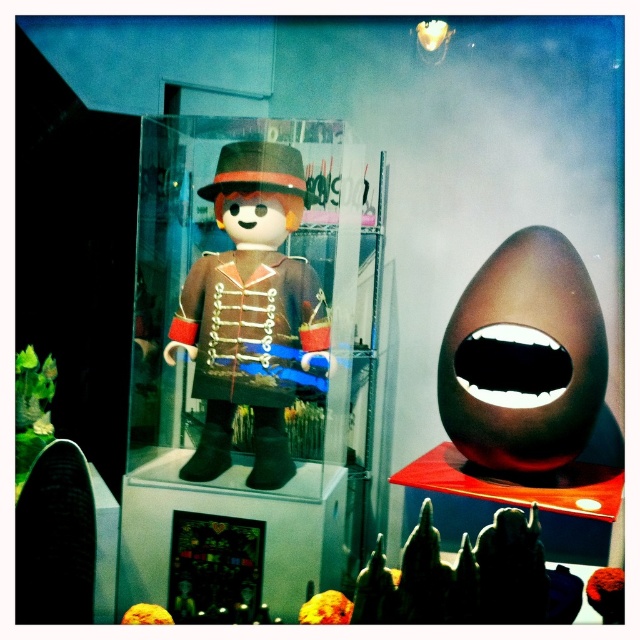
Question: Which of the following is the farthest from the observer?

Choices:
 (A) velvet-like red plush at center
 (B) matte brown toy at center
 (C) golden textured ball at center

Answer: (B)

Question: Where is matte brown egg at upper right located in relation to velvet-like red plush at center in the image?

Choices:
 (A) above
 (B) below

Answer: (A)

Question: Is matte brown egg at upper right wider than orange matte ball at lower left?

Choices:
 (A) no
 (B) yes

Answer: (B)

Question: Which object is farther from the camera taking this photo?

Choices:
 (A) velvet-like red plush at center
 (B) matte brown egg at upper right

Answer: (B)

Question: Which point appears farthest from the camera in this image?

Choices:
 (A) (160, 609)
 (B) (579, 298)
 (C) (608, 621)

Answer: (B)

Question: Does matte brown egg at upper right appear under orange matte ball at lower left?

Choices:
 (A) yes
 (B) no

Answer: (B)